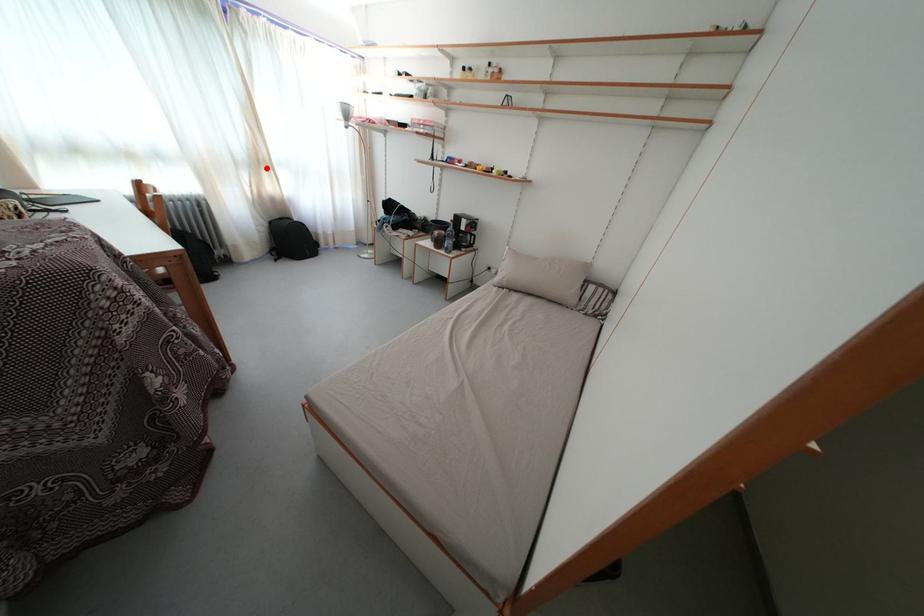
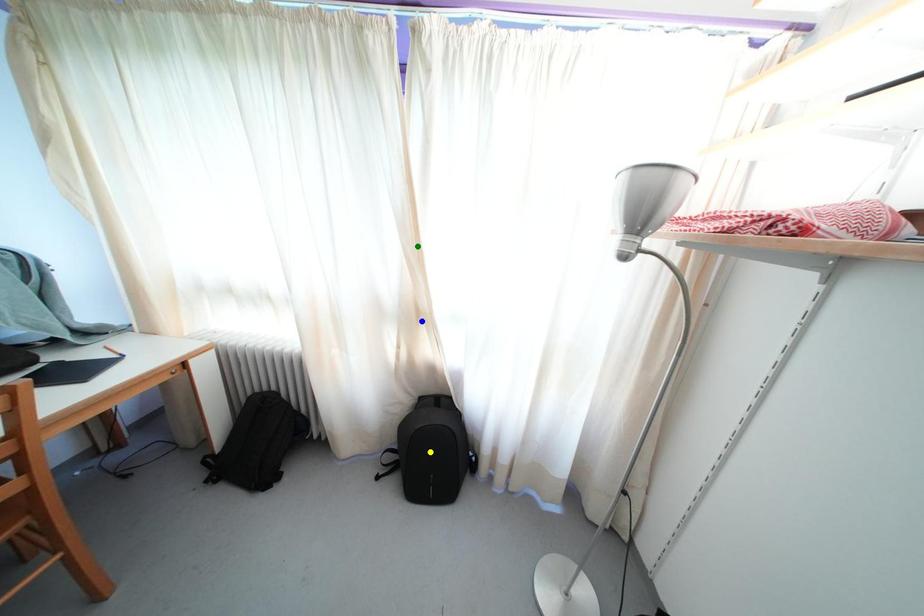
Question: I am providing you with two images of the same scene from different viewpoints. A red point is marked on the first image. You are given multiple points on the second image. Which point in image 2 is actually the same real-world point as the red point in image 1?

Choices:
 (A) blue point
 (B) yellow point
 (C) green point

Answer: (A)